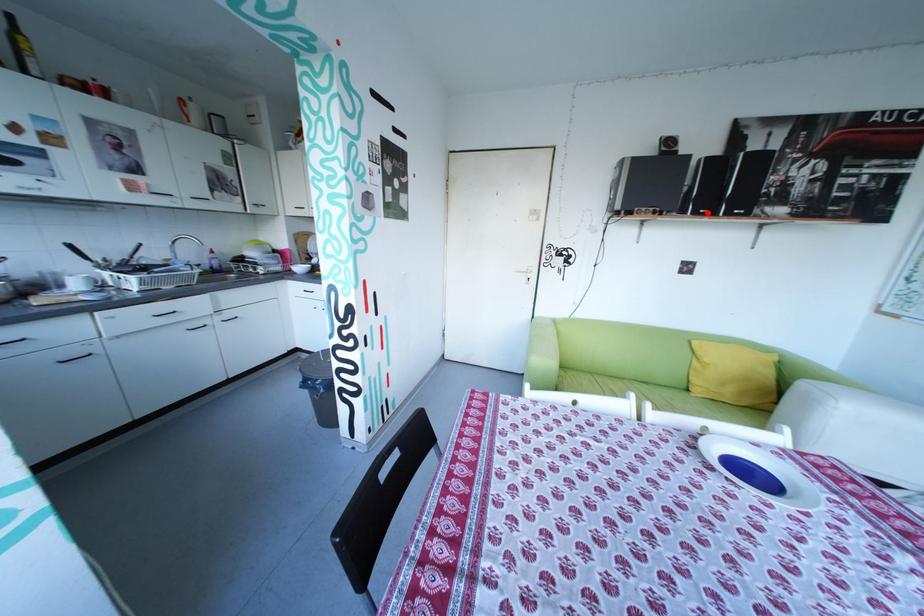
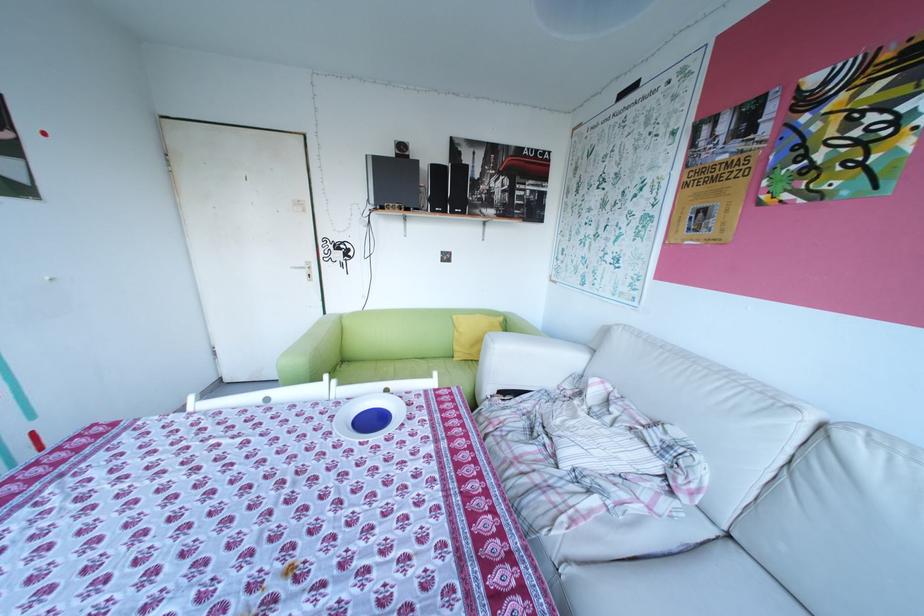
In the second image, find the point that corresponds to the highlighted location in the first image.

(445, 209)